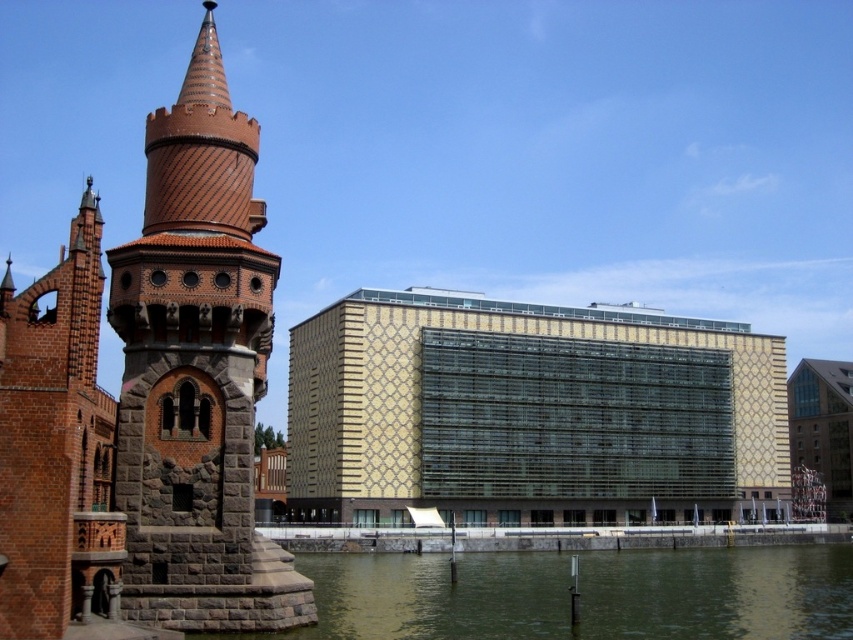
Can you confirm if brown textured stone tower at left is positioned to the left of greenish water at lower center?

Yes, brown textured stone tower at left is to the left of greenish water at lower center.

In the scene shown: Does brown textured stone tower at left have a greater height compared to greenish water at lower center?

Correct, brown textured stone tower at left is much taller as greenish water at lower center.

Which is in front, point (236, 452) or point (488, 632)?

Point (236, 452) is in front.

The image size is (853, 640). What are the coordinates of `brown textured stone tower at left` in the screenshot? It's located at (196, 372).